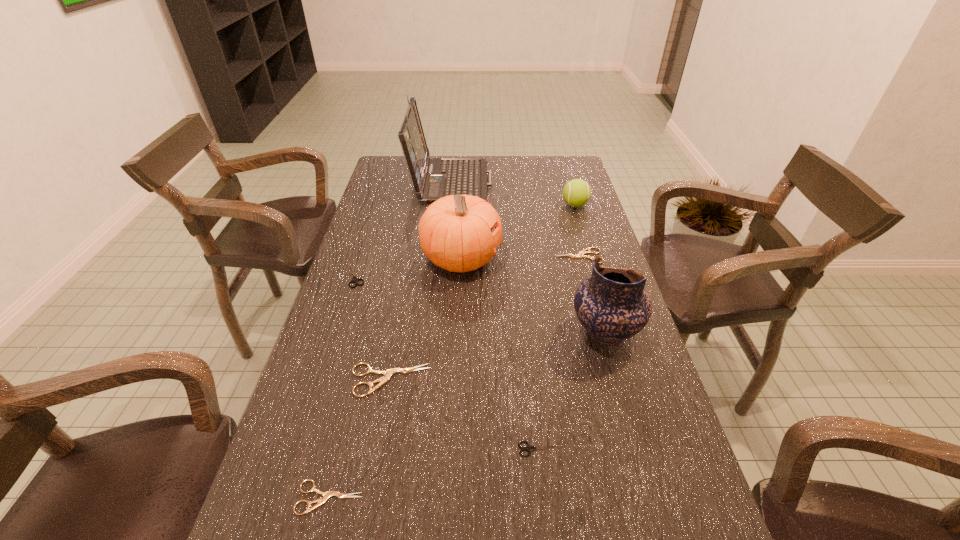
Identify the location of the tallest object. This screenshot has height=540, width=960. (433, 178).

At what (x,y) coordinates should I click in order to perform the action: click on pumpkin. Please return your answer as a coordinate pair (x, y). The width and height of the screenshot is (960, 540). Looking at the image, I should click on (455, 232).

The image size is (960, 540). I want to click on the sixth farthest object, so click(612, 304).

At what (x,y) coordinates should I click in order to perform the action: click on pottery. Please return your answer as a coordinate pair (x, y). The image size is (960, 540). Looking at the image, I should click on (612, 304).

The height and width of the screenshot is (540, 960). What are the coordinates of `green tennis ball` in the screenshot? It's located at (576, 193).

Find the location of a particular element. The width and height of the screenshot is (960, 540). tennis ball is located at coordinates (576, 193).

Locate an element on the screen. the third nearest shears is located at coordinates (388, 373).

In order to click on the biggest beige shears in this screenshot , I will do `click(388, 373)`.

This screenshot has height=540, width=960. What are the coordinates of `the left black shears` in the screenshot? It's located at (355, 280).

Find the location of a particular element. This screenshot has height=540, width=960. the bigger black shears is located at coordinates (355, 280).